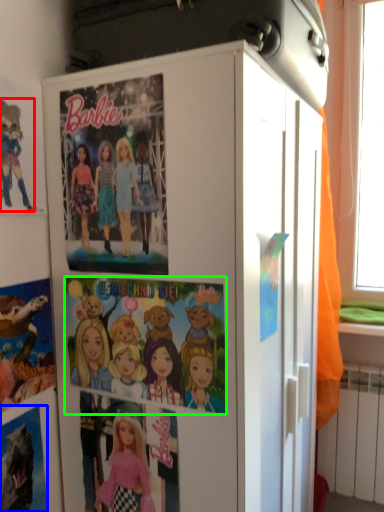
Question: Considering the real-world distances, which object is closest to cartoon (highlighted by a red box)? comic book (highlighted by a blue box) or comic book (highlighted by a green box).

Choices:
 (A) comic book
 (B) comic book

Answer: (B)